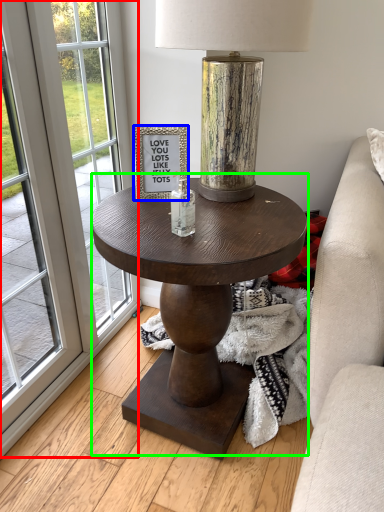
Question: Estimate the real-world distances between objects in this image. Which object is closer to screen door (highlighted by a red box), picture frame (highlighted by a blue box) or coffee table (highlighted by a green box)?

Choices:
 (A) picture frame
 (B) coffee table

Answer: (B)